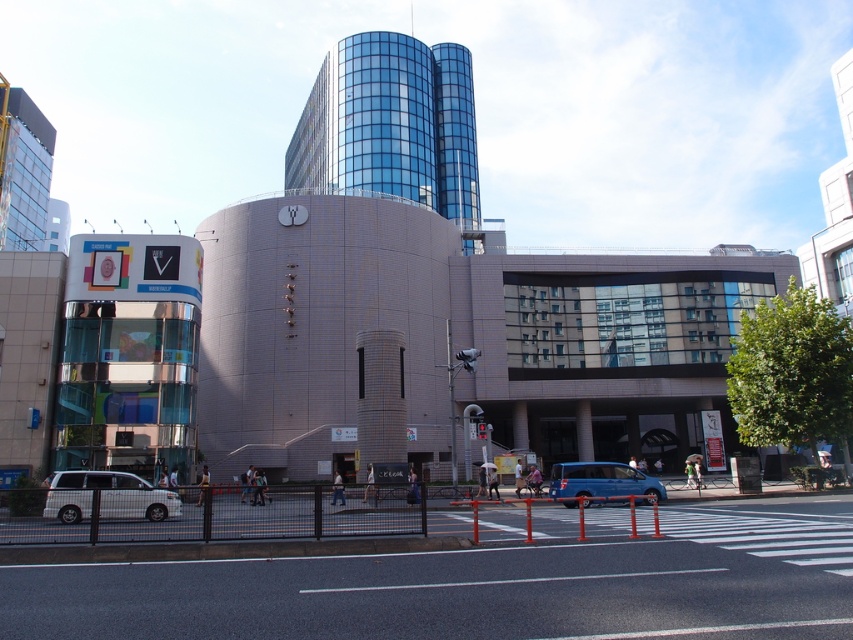
Who is taller, white matte van at lower left or blue metallic van at center?

With more height is blue metallic van at center.

You are a GUI agent. You are given a task and a screenshot of the screen. Output one action in this format:
    pyautogui.click(x=<x>, y=<y>)
    Task: Click on the white matte van at lower left
    
    Given the screenshot: What is the action you would take?
    pyautogui.click(x=107, y=497)

I want to click on white matte van at lower left, so click(107, 497).

The height and width of the screenshot is (640, 853). What are the coordinates of `white matte van at lower left` in the screenshot? It's located at (107, 497).